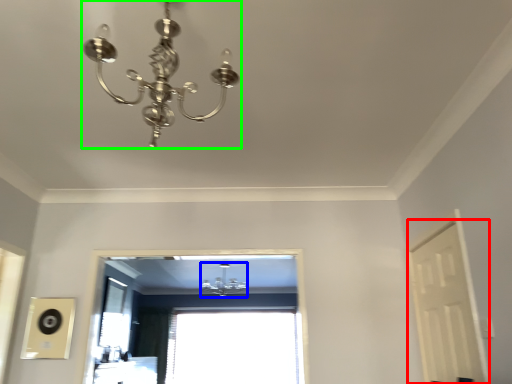
Question: Which object is the farthest from screen door (highlighted by a red box)? Choose among these: lamp (highlighted by a blue box) or lamp (highlighted by a green box).

Choices:
 (A) lamp
 (B) lamp

Answer: (A)